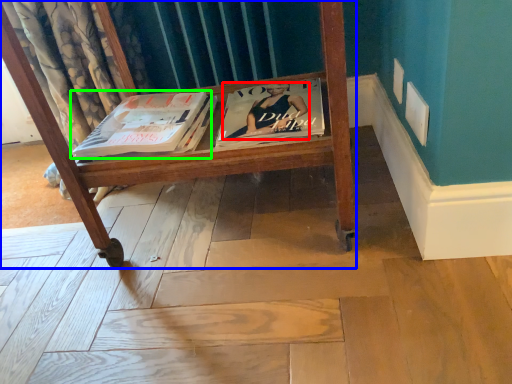
Question: Which object is positioned closest to person (highlighted by a red box)? Select from furniture (highlighted by a blue box) and book (highlighted by a green box).

Choices:
 (A) furniture
 (B) book

Answer: (A)